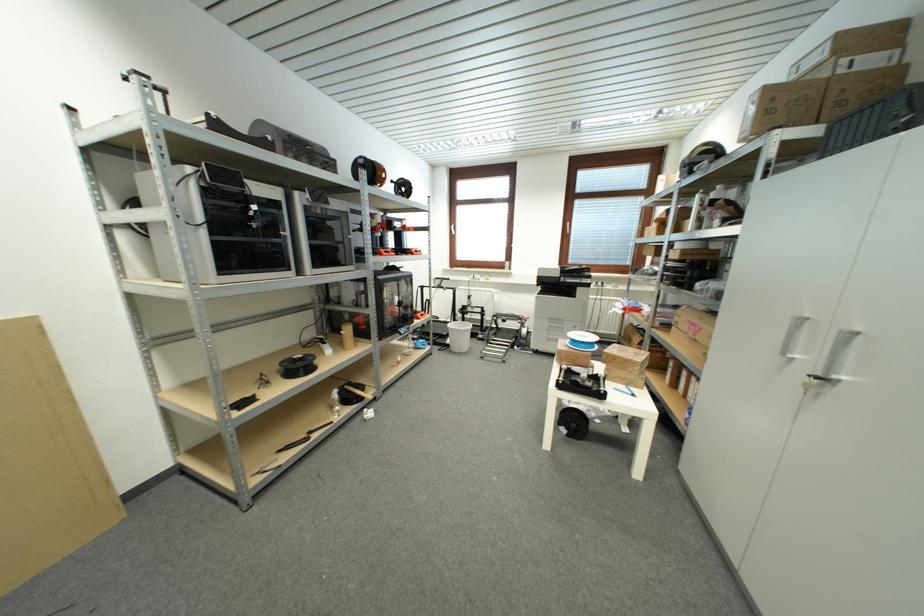
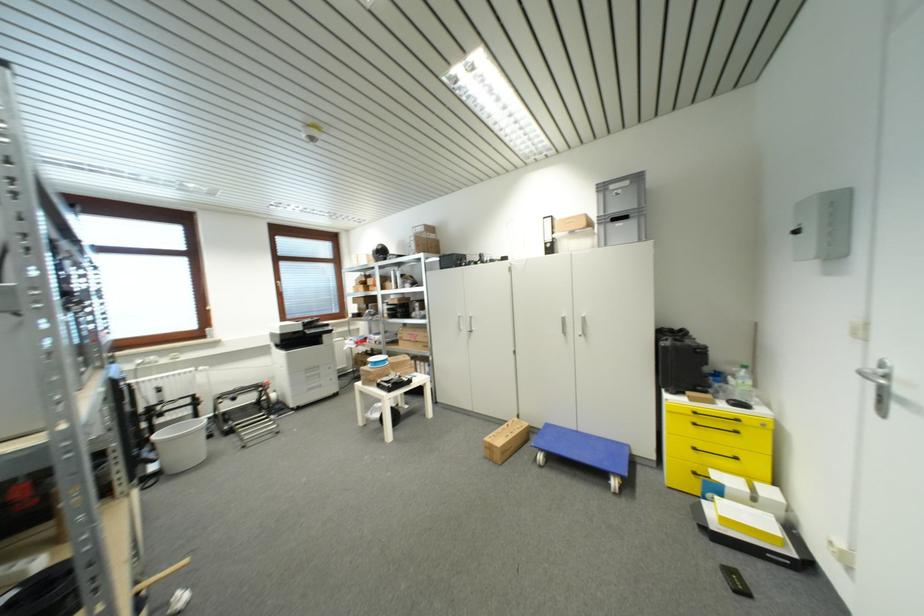
The point at (x=456, y=351) is marked in the first image. Where is the corresponding point in the second image?

(177, 472)